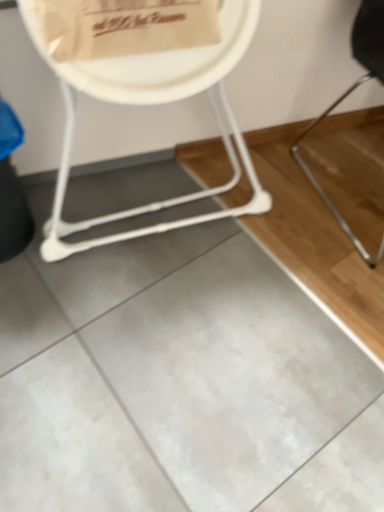
Find the location of `free space to the left of black metal chair at right, the 2th chair positioned from the left`. free space to the left of black metal chair at right, the 2th chair positioned from the left is located at coordinates (271, 211).